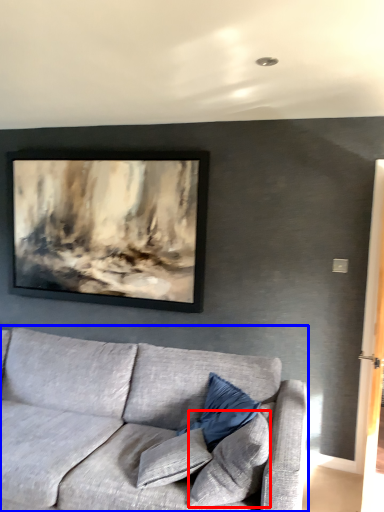
Question: Which object is further to the camera taking this photo, pillow (highlighted by a red box) or studio couch (highlighted by a blue box)?

Choices:
 (A) pillow
 (B) studio couch

Answer: (A)